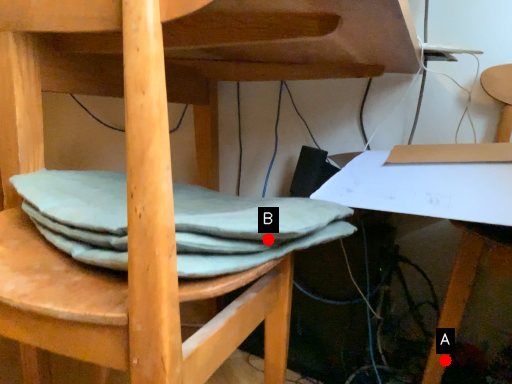
Question: Two points are circled on the image, labeled by A and B beside each circle. Which point is farther to the camera?

Choices:
 (A) A is further
 (B) B is further

Answer: (A)